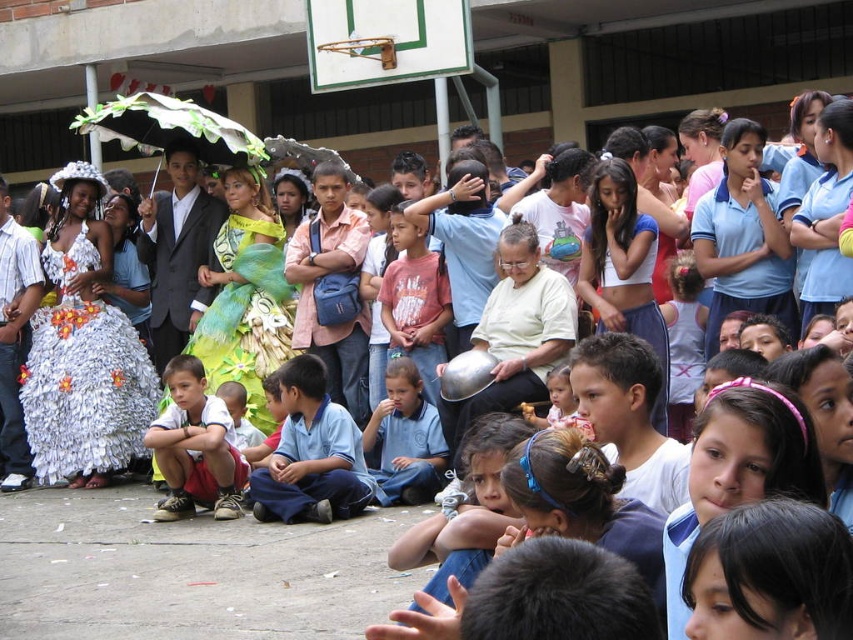
You are standing at the position of the point at coordinates point (216, 129) and want to move towards the point at coordinates point (416, 436). Which direction should you move to reach it?

You should move towards the direction away from the camera since point (216, 129) is closer to the camera than point (416, 436).

You are standing at the position of the viewer. There is a green feathered dress at center. If you want to reach it within 10 seconds, what is the minimum speed you need to move at in feet per second?

The minimum speed required to cover 131.27 feet in 10 seconds is 13.127 feet per second.

You are a photographer at the event and want to capture both the green feathered dress at center and the light blue uniform at center in the same frame. Given their sizes, which one should you focus on to ensure both fit in the photo?

The green feathered dress at center is larger in size than the light blue uniform at center. To ensure both fit in the photo, focus on the green feathered dress at center since it takes up more space and adjusting the camera angle to include it would naturally accommodate the smaller light blue uniform at center.